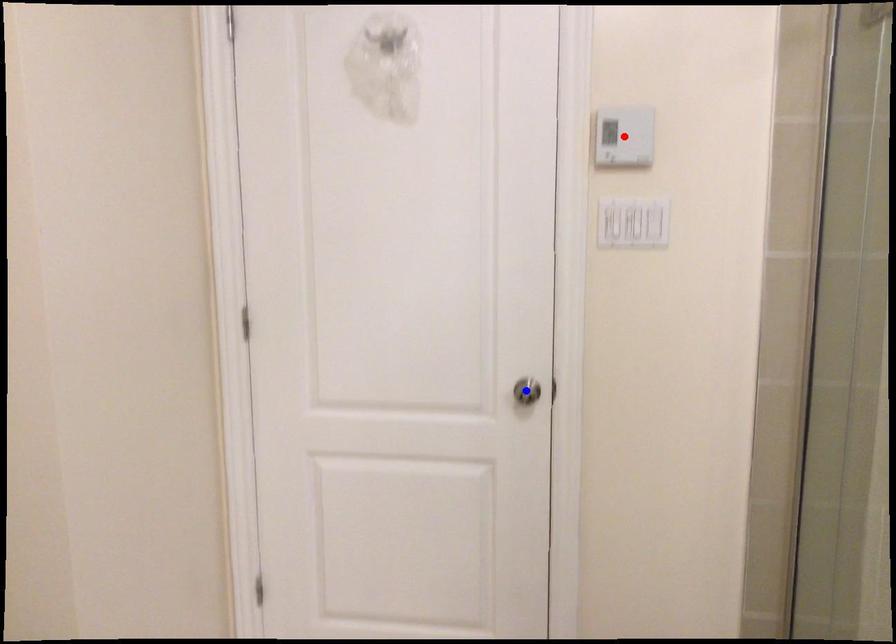
Question: In the image, two points are highlighted. Which point is nearer to the camera? Reply with the corresponding letter.

Choices:
 (A) blue point
 (B) red point

Answer: (B)